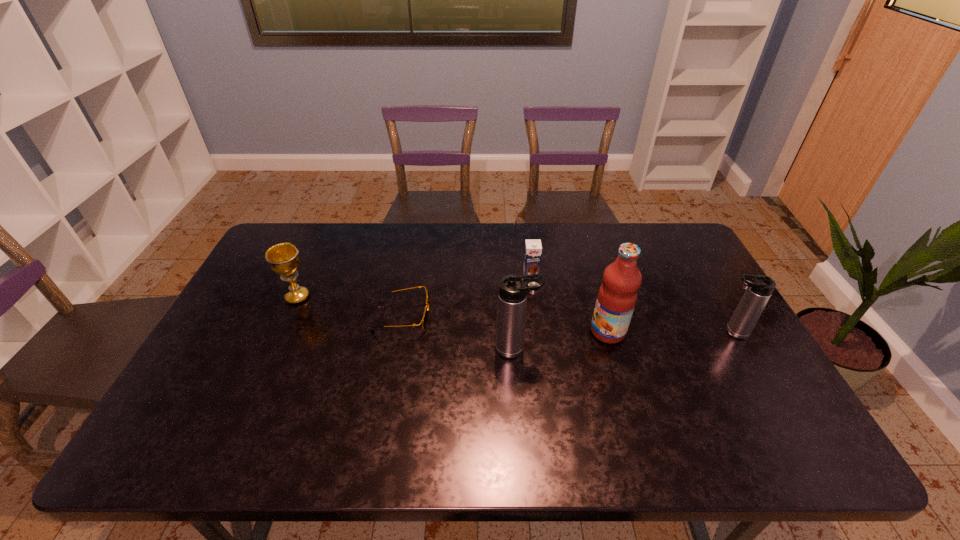
Locate an element on the screen. This screenshot has width=960, height=540. vacant space located 0.080m on the handle side of the second tallest object is located at coordinates (566, 349).

Where is `vacant space situated on the handle side of the shorter thermos bottle`? vacant space situated on the handle side of the shorter thermos bottle is located at coordinates (594, 332).

Where is `vacant space located 0.390m on the handle side of the shorter thermos bottle`? vacant space located 0.390m on the handle side of the shorter thermos bottle is located at coordinates (576, 332).

Locate an element on the screen. vacant space located on the handle side of the shorter thermos bottle is located at coordinates (662, 332).

At what (x,y) coordinates should I click in order to perform the action: click on free space located on the front-facing side of the fifth object from right to left. Please return your answer as a coordinate pair (x, y). The height and width of the screenshot is (540, 960). Looking at the image, I should click on (551, 317).

Identify the location of vacant space located 0.250m on the front label of the chocolate milk. The width and height of the screenshot is (960, 540). (540, 343).

Find the location of a particular element. The image size is (960, 540). vacant region located on the front of the chalice is located at coordinates (276, 344).

Where is `vacant space located on the front label of the second object from right to left`? vacant space located on the front label of the second object from right to left is located at coordinates (475, 332).

Identify the location of vacant space located on the front label of the second object from right to left. Image resolution: width=960 pixels, height=540 pixels. (446, 332).

You are a GUI agent. You are given a task and a screenshot of the screen. Output one action in this format:
    pyautogui.click(x=<x>, y=<y>)
    Task: Click on the free space located on the front label of the second object from right to left
    The image size is (960, 540).
    Given the screenshot: What is the action you would take?
    pyautogui.click(x=533, y=332)